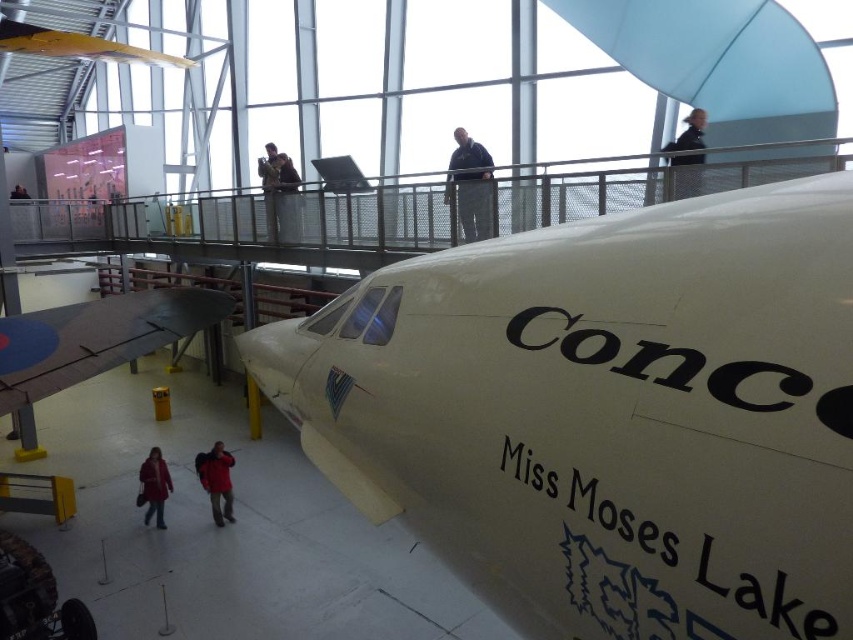
Question: Is black matte text at lower right positioned before dark gray matte wing at lower left?

Choices:
 (A) no
 (B) yes

Answer: (B)

Question: Does white glossy airplane at center come in front of dark blue fabric at upper center?

Choices:
 (A) yes
 (B) no

Answer: (A)

Question: Considering the real-world distances, which object is closest to the dark blue jacket at upper center?

Choices:
 (A) dark gray matte wing at lower left
 (B) red jacket at lower left
 (C) black leather jacket at upper center

Answer: (A)

Question: Among these objects, which one is farthest from the camera?

Choices:
 (A) black leather jacket at upper center
 (B) dark blue fabric at upper center
 (C) dark blue jacket at upper center

Answer: (C)

Question: Which of these objects is positioned farthest from the dark gray matte wing at lower left?

Choices:
 (A) red jacket at lower left
 (B) dark blue fabric at upper center
 (C) dark blue jacket at upper center

Answer: (B)

Question: Does black matte text at lower right appear on the left side of matte red coat at lower left?

Choices:
 (A) no
 (B) yes

Answer: (A)